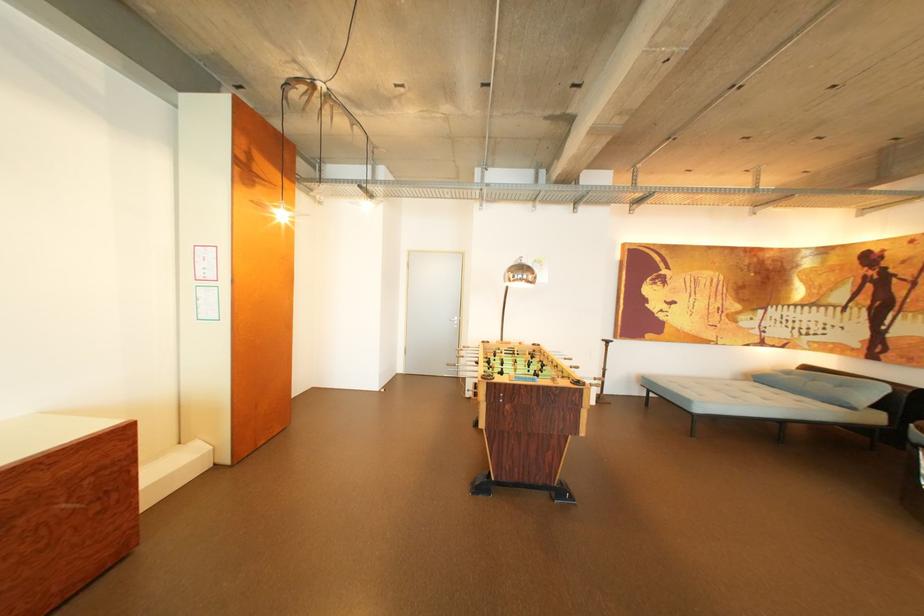
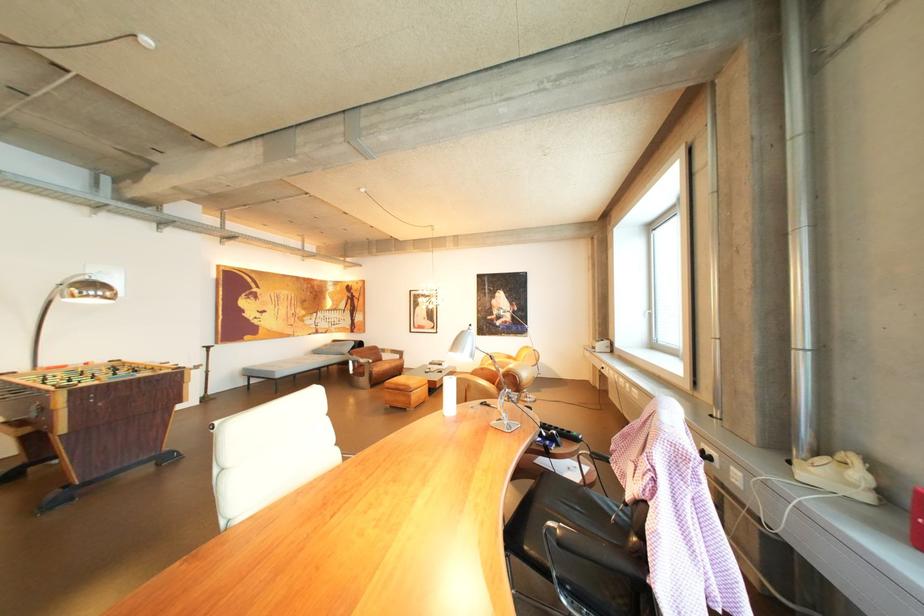
Where in the second image is the point corresponding to the point at 701,402 from the first image?

(286, 373)